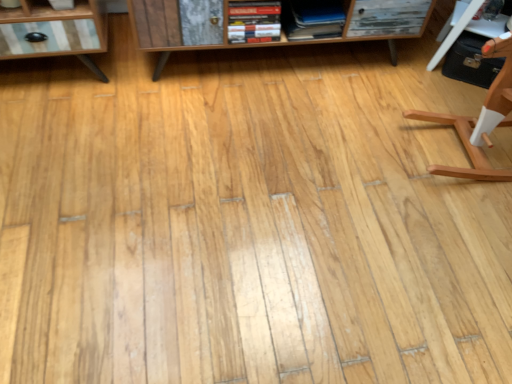
Locate an element on the screen. Image resolution: width=512 pixels, height=384 pixels. free space to the back side of light brown wood rocking chair at right is located at coordinates (420, 89).